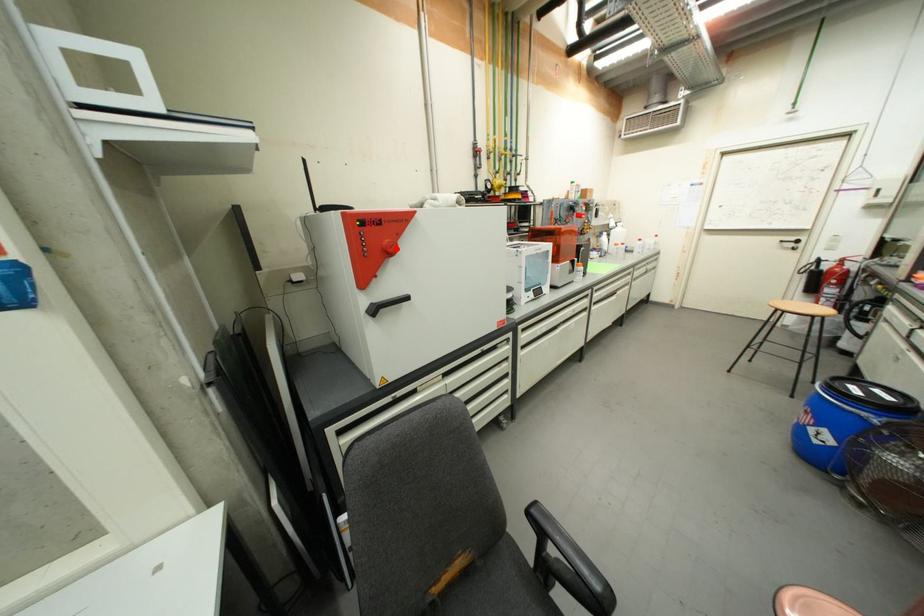
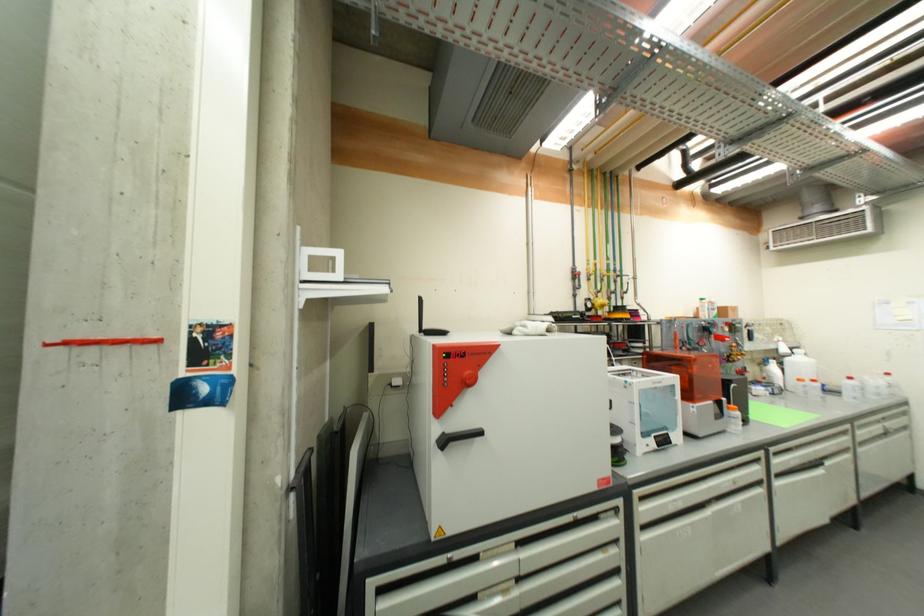
Question: I am providing you with two images of the same scene from different viewpoints. A red point is marked on the first image. Is the red point's position out of view in image 2?

Choices:
 (A) Yes
 (B) No

Answer: (B)